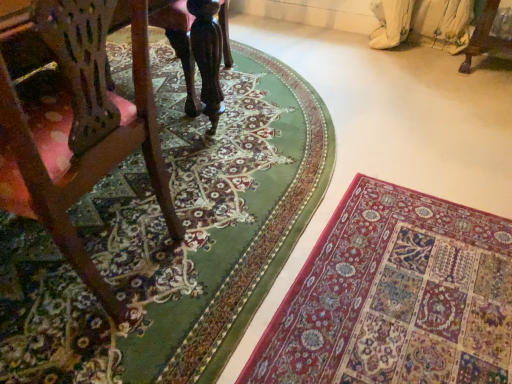
Question: Should I look upward or downward to see rich red carpet at lower right, the 2th mat in the left-to-right sequence?

Choices:
 (A) down
 (B) up

Answer: (A)

Question: Does wooden chair at left have a lesser height compared to rich red carpet at lower right, the 2th mat in the left-to-right sequence?

Choices:
 (A) no
 (B) yes

Answer: (A)

Question: Considering the relative positions of wooden chair at left and rich red carpet at lower right, the 2th mat in the left-to-right sequence, in the image provided, is wooden chair at left to the right of rich red carpet at lower right, the 2th mat in the left-to-right sequence, from the viewer's perspective?

Choices:
 (A) yes
 (B) no

Answer: (B)

Question: Is rich red carpet at lower right, positioned as the first mat in right-to-left order, located within wooden chair at left?

Choices:
 (A) no
 (B) yes

Answer: (A)

Question: Is the depth of wooden chair at left greater than that of rich red carpet at lower right, positioned as the first mat in right-to-left order?

Choices:
 (A) no
 (B) yes

Answer: (A)

Question: From a real-world perspective, does wooden chair at left sit lower than rich red carpet at lower right, the 2th mat in the left-to-right sequence?

Choices:
 (A) no
 (B) yes

Answer: (A)

Question: From a real-world perspective, is wooden chair at left over rich red carpet at lower right, positioned as the first mat in right-to-left order?

Choices:
 (A) yes
 (B) no

Answer: (A)

Question: Does carpeted floor at lower right, the second mat when ordered from right to left, have a larger size compared to wooden chair at left?

Choices:
 (A) no
 (B) yes

Answer: (A)

Question: Does carpeted floor at lower right, the second mat when ordered from right to left, appear on the right side of wooden chair at left?

Choices:
 (A) no
 (B) yes

Answer: (B)

Question: Considering the relative sizes of carpeted floor at lower right, the 1th mat when ordered from left to right, and wooden chair at left in the image provided, is carpeted floor at lower right, the 1th mat when ordered from left to right, thinner than wooden chair at left?

Choices:
 (A) no
 (B) yes

Answer: (A)

Question: Can you confirm if carpeted floor at lower right, the 1th mat when ordered from left to right, is smaller than wooden chair at left?

Choices:
 (A) no
 (B) yes

Answer: (B)

Question: From a real-world perspective, is carpeted floor at lower right, the 1th mat when ordered from left to right, under wooden chair at left?

Choices:
 (A) no
 (B) yes

Answer: (B)

Question: Is carpeted floor at lower right, the second mat when ordered from right to left, far from wooden chair at left?

Choices:
 (A) yes
 (B) no

Answer: (B)

Question: From a real-world perspective, is wooden chair at left over carpeted floor at lower right, the second mat when ordered from right to left?

Choices:
 (A) yes
 (B) no

Answer: (A)